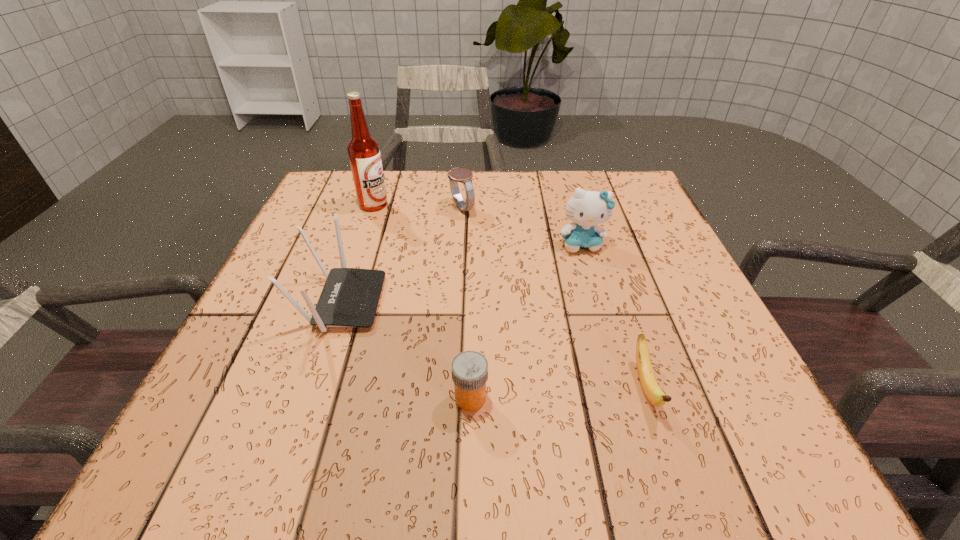
Find the location of a particular element. The height and width of the screenshot is (540, 960). vacant space positioned on the label side of the fifth tallest object is located at coordinates (600, 398).

The width and height of the screenshot is (960, 540). What are the coordinates of `vacant space located 0.080m at the stem of the shortest object` in the screenshot? It's located at (675, 477).

Where is `alcohol that is at the far edge`? This screenshot has width=960, height=540. alcohol that is at the far edge is located at coordinates (363, 150).

Identify the location of watch that is at the far edge. This screenshot has height=540, width=960. (462, 175).

Locate an element on the screen. object situated at the near edge is located at coordinates (655, 395).

You are a GUI agent. You are given a task and a screenshot of the screen. Output one action in this format:
    pyautogui.click(x=<x>, y=<y>)
    Task: Click on the alcohol positioned at the left edge
    This screenshot has height=540, width=960.
    Given the screenshot: What is the action you would take?
    pyautogui.click(x=363, y=150)

The image size is (960, 540). What are the coordinates of `router that is at the left edge` in the screenshot? It's located at (350, 296).

Where is `object that is positioned at the right edge`? The height and width of the screenshot is (540, 960). object that is positioned at the right edge is located at coordinates (587, 209).

Image resolution: width=960 pixels, height=540 pixels. Identify the location of object located at the far left corner. (363, 150).

Identify the location of free space at the far edge. This screenshot has width=960, height=540. (419, 174).